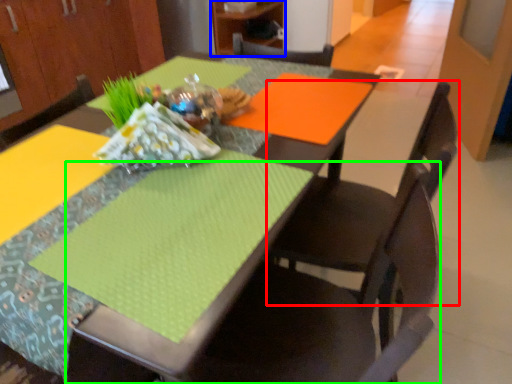
Question: Which object is the closest to the chair (highlighted by a red box)? Choose among these: cabinetry (highlighted by a blue box) or chair (highlighted by a green box).

Choices:
 (A) cabinetry
 (B) chair

Answer: (B)